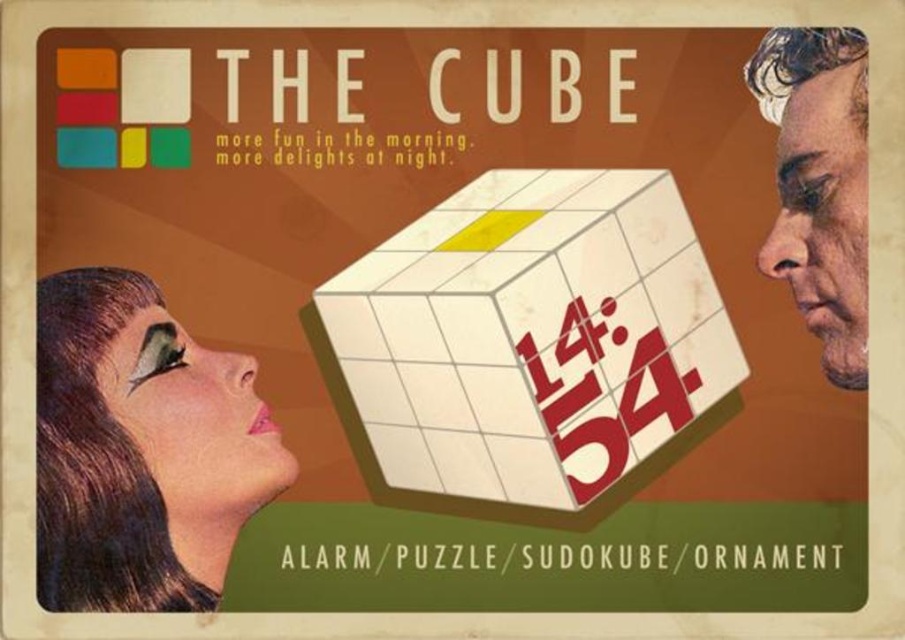
Does point (564, 340) lie behind point (816, 150)?

No, (564, 340) is in front of (816, 150).

Does white matte cube at center appear over smooth skin face at right?

No.

This screenshot has height=640, width=905. I want to click on white matte cube at center, so click(529, 346).

Based on the photo, which of these two, matte black face at lower left or smooth skin face at right, stands shorter?

Standing shorter between the two is matte black face at lower left.

Can you confirm if matte black face at lower left is smaller than smooth skin face at right?

Incorrect, matte black face at lower left is not smaller in size than smooth skin face at right.

Is point (235, 490) in front of point (780, 28)?

Yes, it is.

Image resolution: width=905 pixels, height=640 pixels. Find the location of `matte black face at lower left`. matte black face at lower left is located at coordinates (140, 449).

Can you confirm if white matte cube at center is bigger than matte black face at lower left?

Yes.

Does white matte cube at center have a smaller size compared to matte black face at lower left?

No, white matte cube at center is not smaller than matte black face at lower left.

Is point (465, 504) positioned behind point (60, 292)?

Yes, point (465, 504) is behind point (60, 292).

Find the location of `white matte cube at center`. white matte cube at center is located at coordinates (529, 346).